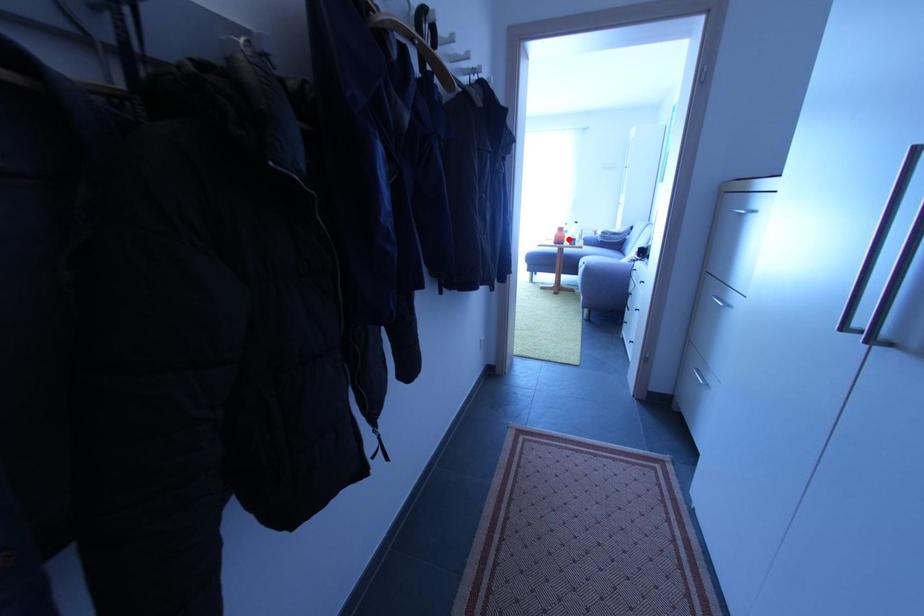
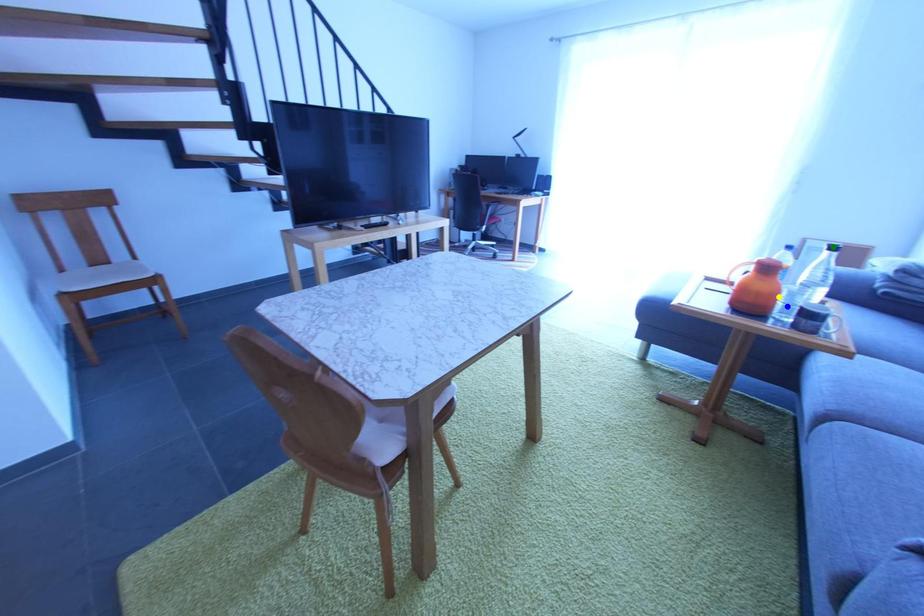
Question: I am providing you with two images of the same scene from different viewpoints. A red point is marked on the first image. You are given multiple points on the second image. Can you choose the point in image 2 that corresponds to the point in image 1?

Choices:
 (A) blue point
 (B) green point
 (C) yellow point

Answer: (C)